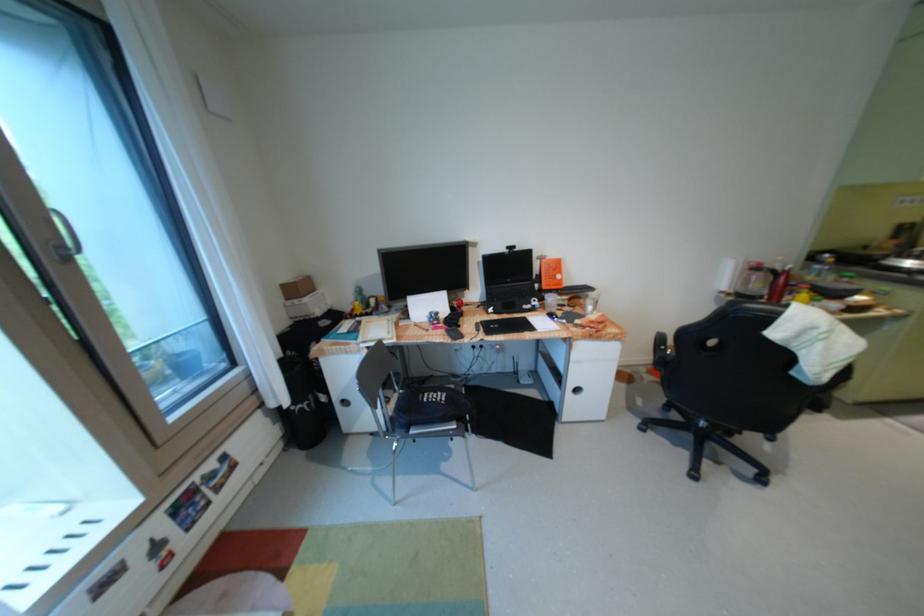
Where is `orange book`? Image resolution: width=924 pixels, height=616 pixels. orange book is located at coordinates (551, 274).